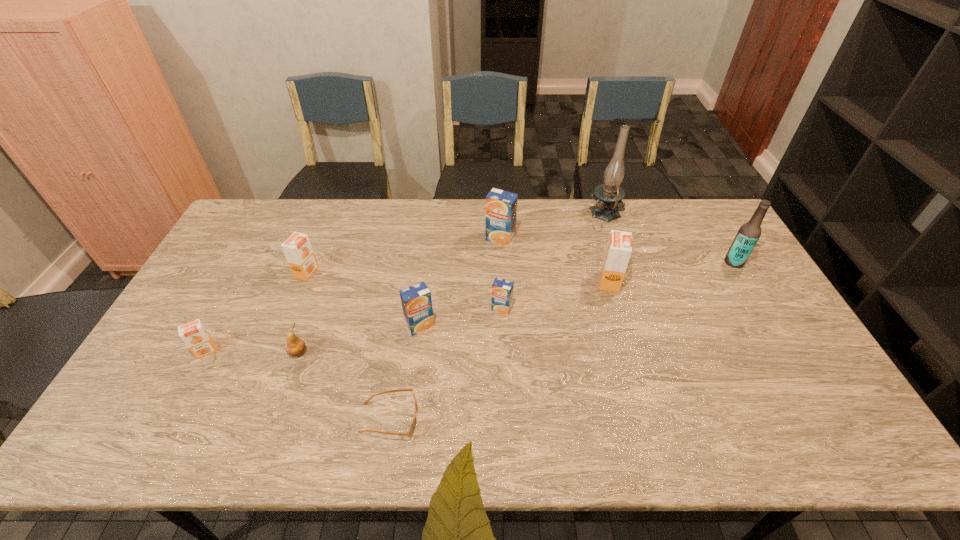
What are the coordinates of `the second smallest orange orange juice` in the screenshot? It's located at (298, 251).

The image size is (960, 540). I want to click on the second object from left to right, so click(298, 251).

Where is `the fifth nearest object`? The height and width of the screenshot is (540, 960). the fifth nearest object is located at coordinates (502, 290).

The image size is (960, 540). Identify the location of the third nearest orange juice. click(502, 290).

The width and height of the screenshot is (960, 540). I want to click on the smallest orange orange juice, so coord(194,334).

Image resolution: width=960 pixels, height=540 pixels. In order to click on the nearest orange juice in this screenshot , I will do 194,334.

Locate an element on the screen. The width and height of the screenshot is (960, 540). pear is located at coordinates (295, 346).

This screenshot has height=540, width=960. Identify the location of sunglasses. (411, 430).

Find the location of a particular element. The width and height of the screenshot is (960, 540). the nearest object is located at coordinates (411, 430).

Locate an element on the screen. Image resolution: width=960 pixels, height=540 pixels. vacant space located 0.160m on the left of the farthest object is located at coordinates (547, 215).